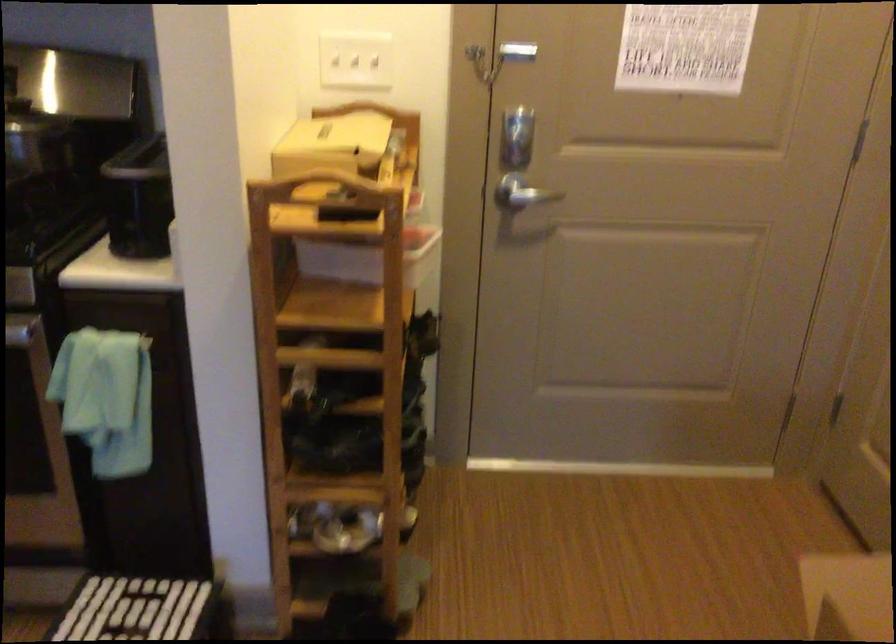
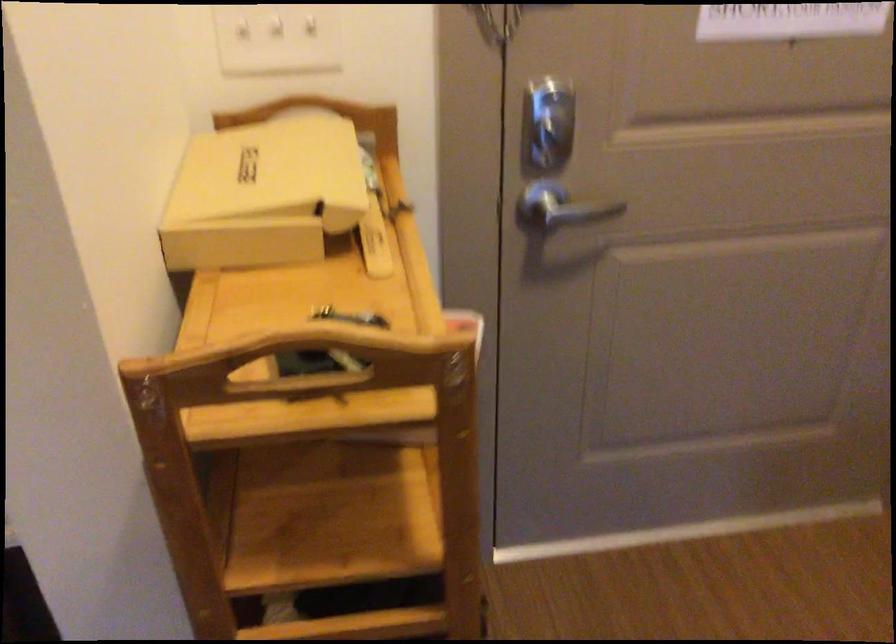
Where in the second image is the point corresponding to point (528, 192) from the first image?

(558, 210)